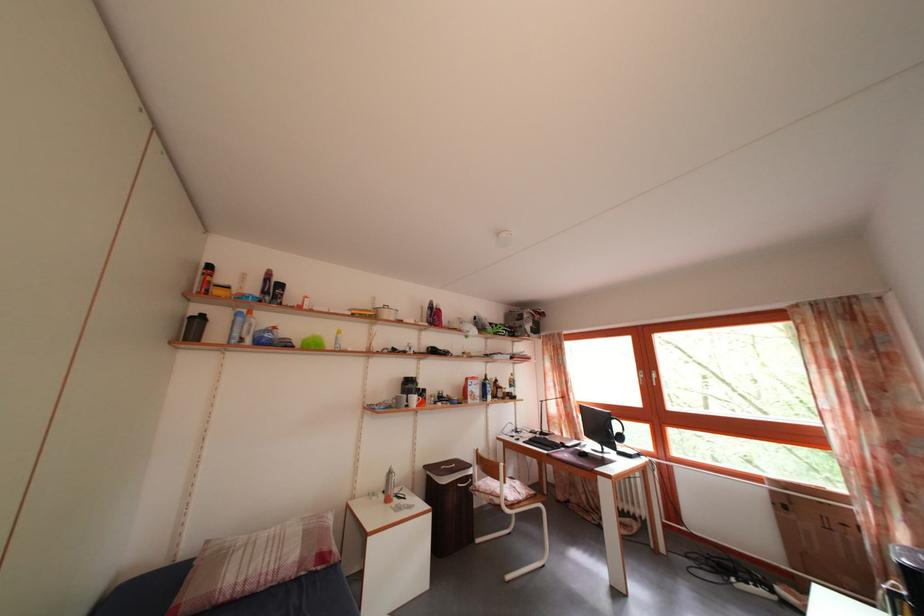
Image resolution: width=924 pixels, height=616 pixels. I want to click on trash can lid, so click(x=447, y=469).